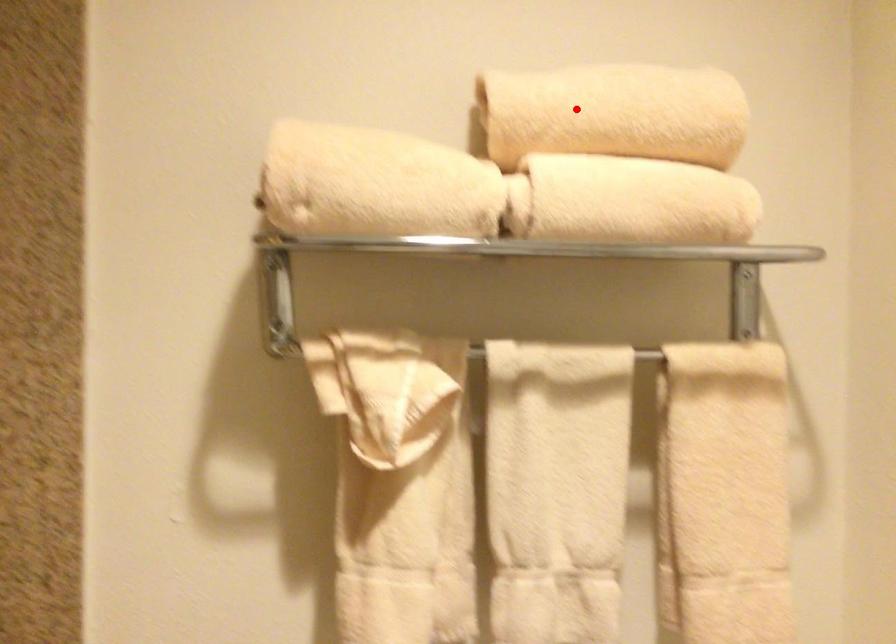
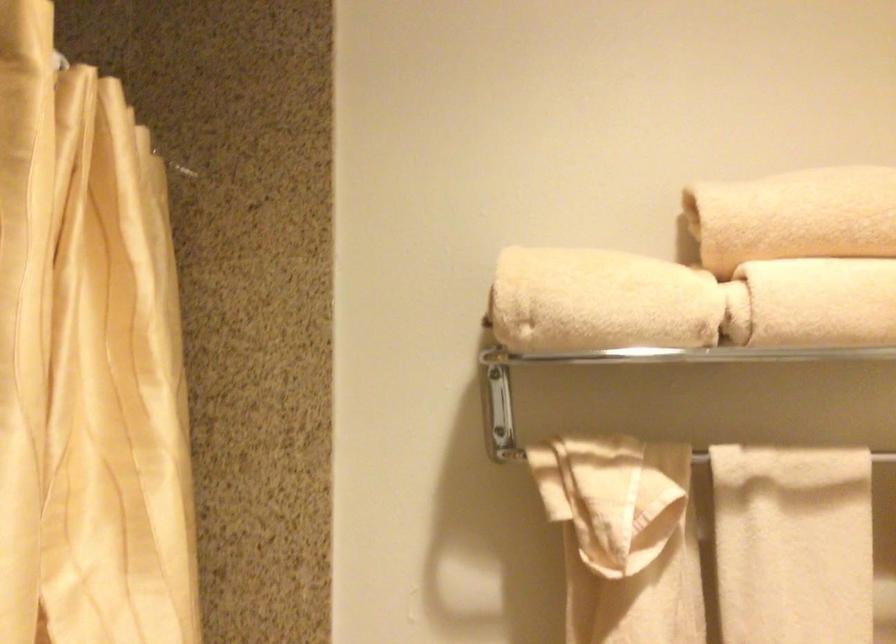
Where in the second image is the point corresponding to the highlighted location from the first image?

(794, 216)